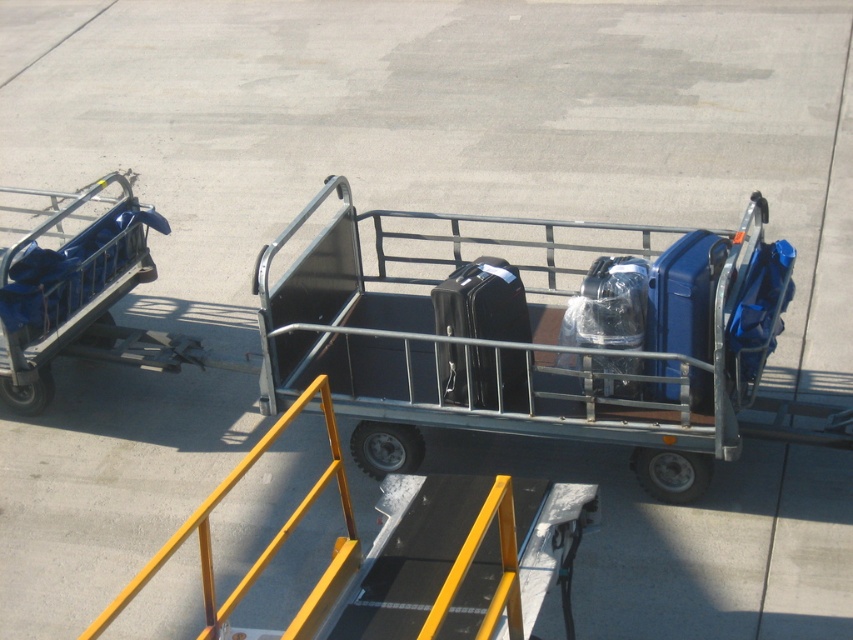
Question: In this image, where is blue hardshell suitcase at center-right located relative to clear plastic suitcase at center?

Choices:
 (A) below
 (B) above

Answer: (B)

Question: Which of these objects is positioned farthest from the blue hardshell suitcase at center-right?

Choices:
 (A) clear plastic suitcase at center
 (B) black hard suitcase at center
 (C) metallic gray luggage cart at center

Answer: (B)

Question: Is black hard suitcase at center closer to camera compared to blue hardshell suitcase at center-right?

Choices:
 (A) no
 (B) yes

Answer: (A)

Question: Is metallic gray luggage cart at center smaller than clear plastic suitcase at center?

Choices:
 (A) no
 (B) yes

Answer: (A)

Question: Which point appears farthest from the camera in this image?

Choices:
 (A) (480, 266)
 (B) (485, 365)

Answer: (A)

Question: Which of these objects is positioned farthest from the metallic gray luggage cart at center?

Choices:
 (A) black hard suitcase at center
 (B) blue hardshell suitcase at center-right

Answer: (B)